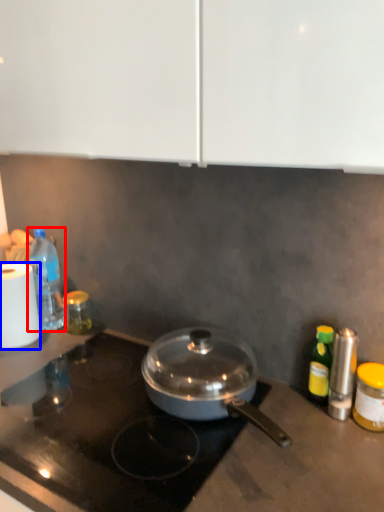
Question: Among these objects, which one is nearest to the camera, bottle (highlighted by a red box) or paper towel (highlighted by a blue box)?

Choices:
 (A) bottle
 (B) paper towel

Answer: (B)